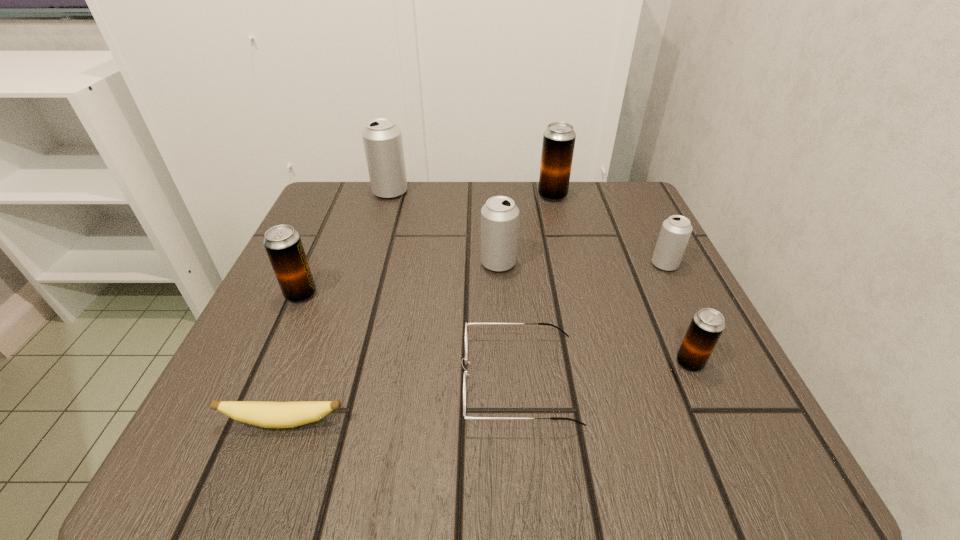
Find the location of a particular element. The width and height of the screenshot is (960, 540). vacant space located 0.360m on the left of the smallest black beer can is located at coordinates (436, 362).

Where is `free space located on the front-facing side of the black spectacles`? free space located on the front-facing side of the black spectacles is located at coordinates (283, 380).

Locate an element on the screen. vacant region located 0.160m on the front-facing side of the black spectacles is located at coordinates (352, 380).

Where is `vacant space situated on the front-facing side of the black spectacles`? vacant space situated on the front-facing side of the black spectacles is located at coordinates (359, 380).

This screenshot has width=960, height=540. Find the location of `vacant space situated 0.050m on the back of the shortest object`. vacant space situated 0.050m on the back of the shortest object is located at coordinates (299, 382).

This screenshot has width=960, height=540. Identify the location of spectacles that is at the near edge. (469, 324).

Where is `banana located in the near edge section of the desktop`? The height and width of the screenshot is (540, 960). banana located in the near edge section of the desktop is located at coordinates (263, 414).

I want to click on banana that is at the left edge, so click(263, 414).

Locate an element on the screen. Image resolution: width=960 pixels, height=540 pixels. object present at the far left corner is located at coordinates pos(382,138).

Identify the location of object at the near left corner. This screenshot has height=540, width=960. (263, 414).